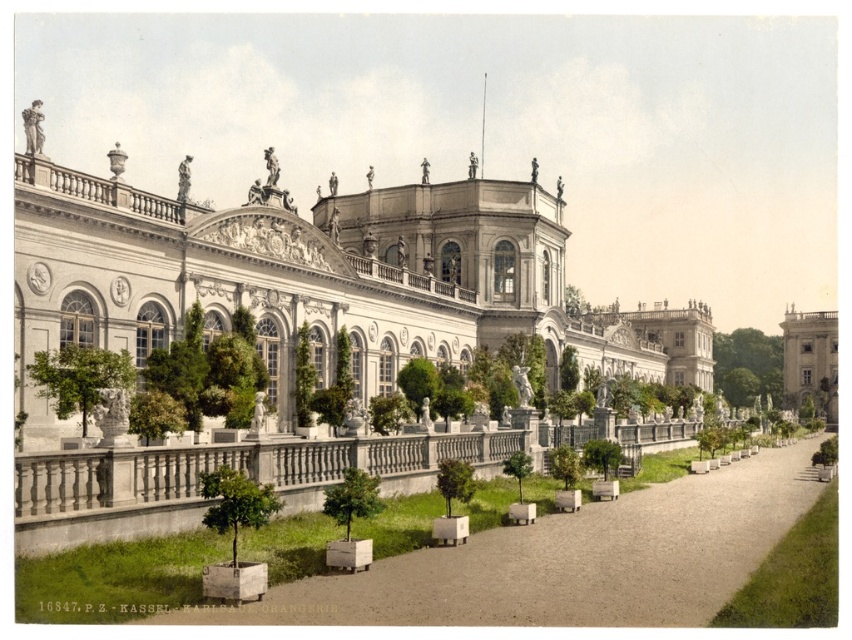
Question: Can you confirm if white stone palace at center is positioned to the right of stone/concrete building at right?

Choices:
 (A) yes
 (B) no

Answer: (B)

Question: Which is nearer to the stone/concrete building at right?

Choices:
 (A) smooth concrete path at center
 (B) white stone palace at center

Answer: (B)

Question: Does white stone palace at center have a larger size compared to stone/concrete building at right?

Choices:
 (A) no
 (B) yes

Answer: (B)

Question: Which is nearer to the stone/concrete building at right?

Choices:
 (A) smooth concrete path at center
 (B) white stone palace at center

Answer: (B)

Question: Is smooth concrete path at center thinner than stone/concrete building at right?

Choices:
 (A) no
 (B) yes

Answer: (A)

Question: Which of the following is the closest to the observer?

Choices:
 (A) [401, 189]
 (B) [689, 504]

Answer: (B)